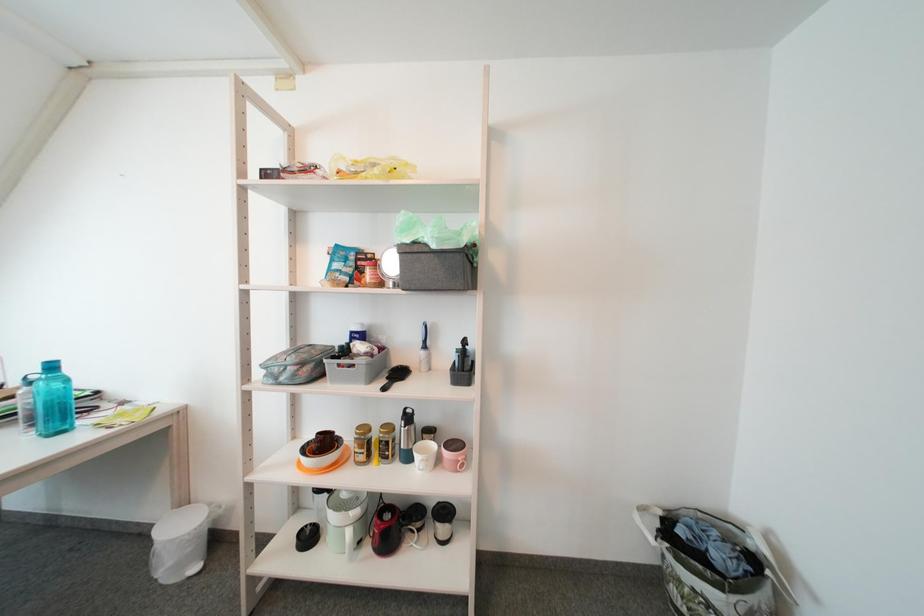
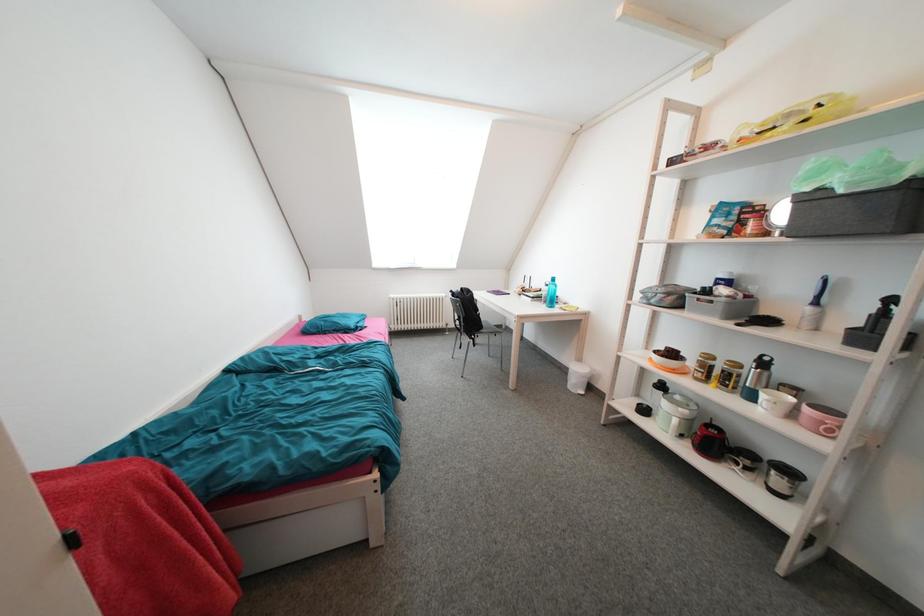
Question: How did the camera likely rotate?

Choices:
 (A) Left
 (B) Right
 (C) Up
 (D) Down

Answer: (A)